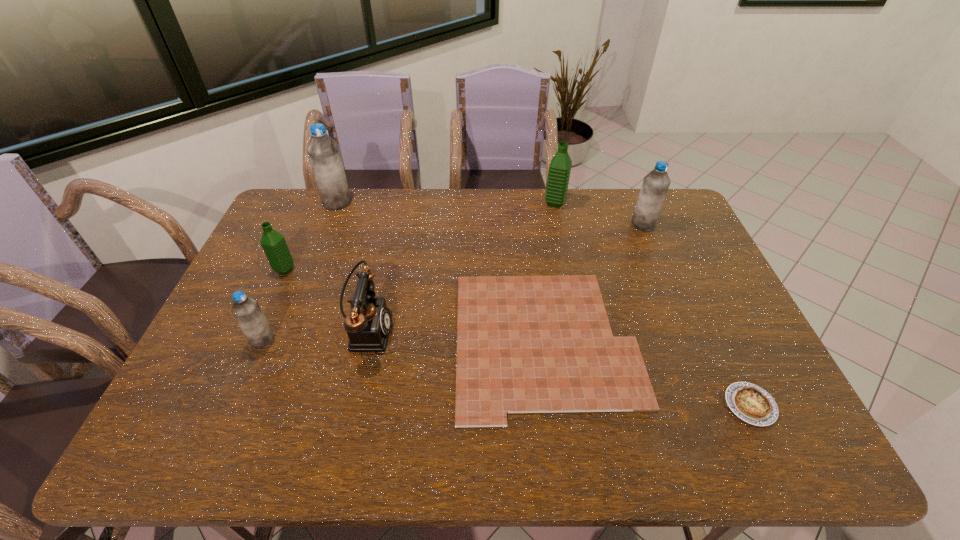
Locate an element on the screen. This screenshot has height=540, width=960. the second nearest water bottle is located at coordinates (274, 245).

Find the location of `the left green water bottle`. the left green water bottle is located at coordinates (274, 245).

Locate an element on the screen. the seventh tallest object is located at coordinates (751, 403).

Locate an element on the screen. The height and width of the screenshot is (540, 960). the shortest object is located at coordinates (525, 344).

Locate an element on the screen. Image resolution: width=960 pixels, height=540 pixels. vacant region located on the front of the tallest water bottle is located at coordinates (309, 273).

Locate an element on the screen. The height and width of the screenshot is (540, 960). vacant space located on the right of the right green water bottle is located at coordinates (661, 203).

The image size is (960, 540). Identify the location of vacant space located 0.220m on the left of the rightmost water bottle. (568, 224).

Where is `blank area located 0.210m on the front of the fifth object from right to left at the rotary dial`? The image size is (960, 540). blank area located 0.210m on the front of the fifth object from right to left at the rotary dial is located at coordinates (469, 329).

Find the location of a particular element. vacant space located 0.100m on the left of the nearest water bottle is located at coordinates (214, 340).

The height and width of the screenshot is (540, 960). What are the coordinates of `vacant space located 0.310m on the right of the smaller green water bottle` in the screenshot? It's located at (394, 270).